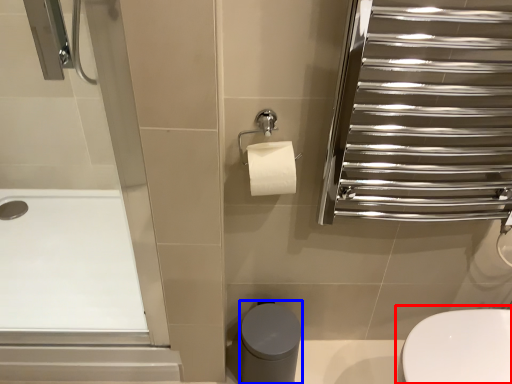
Question: Which of the following is the farthest to the observer, toilet (highlighted by a red box) or bidet (highlighted by a blue box)?

Choices:
 (A) toilet
 (B) bidet

Answer: (B)